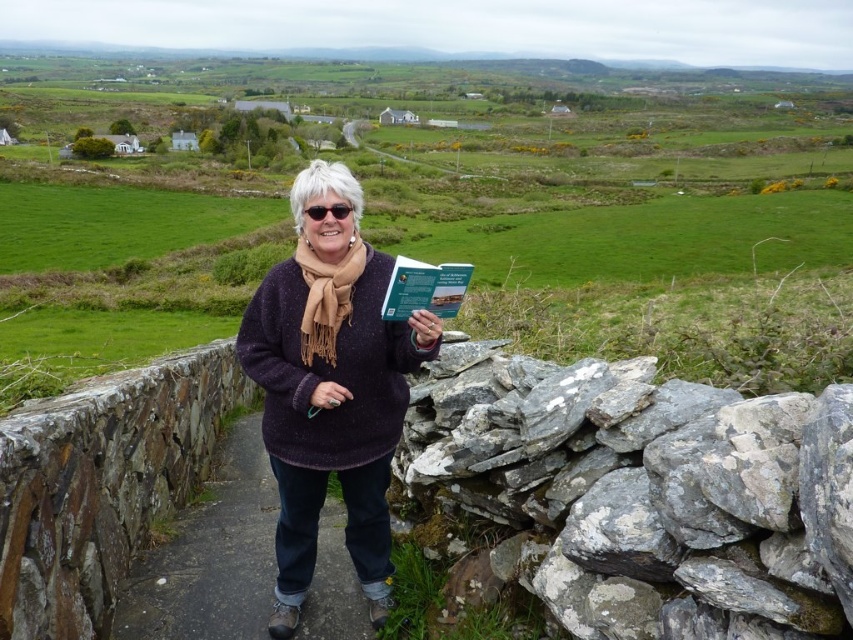
Question: Which of these objects is positioned closest to the dark stone path at center?

Choices:
 (A) green matte book at center
 (B) purple wool sweater at center

Answer: (B)

Question: Considering the real-world distances, which object is farthest from the dark stone path at center?

Choices:
 (A) tan soft scarf at center
 (B) green matte book at center
 (C) purple wool sweater at center

Answer: (B)

Question: Can you confirm if dark stone path at center is positioned to the right of tan soft scarf at center?

Choices:
 (A) yes
 (B) no

Answer: (B)

Question: Can you confirm if purple wool sweater at center is wider than tan soft scarf at center?

Choices:
 (A) no
 (B) yes

Answer: (B)

Question: Which object is closer to the camera taking this photo?

Choices:
 (A) tan soft scarf at center
 (B) green matte book at center
 (C) dark stone path at center
 (D) gray rough stone at right

Answer: (D)

Question: Is the position of purple wool sweater at center less distant than that of green matte book at center?

Choices:
 (A) yes
 (B) no

Answer: (B)